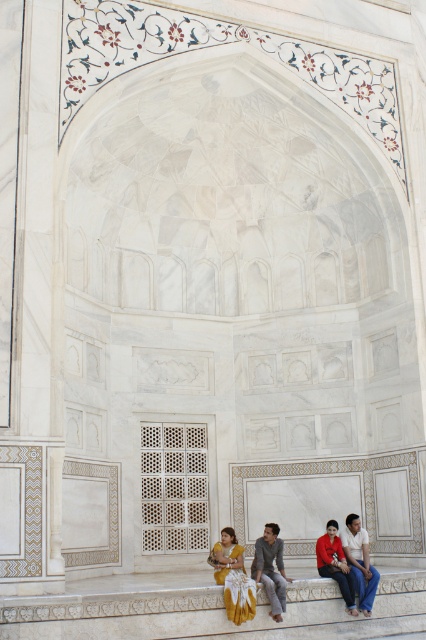
Is the position of white marble ledge at lower center more distant than that of satin yellow sari at lower center?

No, it is in front of satin yellow sari at lower center.

Does point (63, 595) come in front of point (227, 589)?

Yes, point (63, 595) is closer to viewer.

Where is `white marble ledge at lower center`? This screenshot has width=426, height=640. white marble ledge at lower center is located at coordinates (161, 609).

Does satin yellow sari at lower center have a smaller size compared to white marble person at lower right?

Actually, satin yellow sari at lower center might be larger than white marble person at lower right.

Does satin yellow sari at lower center lie behind white marble person at lower right?

No, satin yellow sari at lower center is in front of white marble person at lower right.

Who is more forward, (235,580) or (363,595)?

Point (235,580) is more forward.

What are the coordinates of `satin yellow sari at lower center` in the screenshot? It's located at (233, 577).

What do you see at coordinates (233, 577) in the screenshot? The image size is (426, 640). I see `satin yellow sari at lower center` at bounding box center [233, 577].

Where is `satin yellow sari at lower center`? satin yellow sari at lower center is located at coordinates (233, 577).